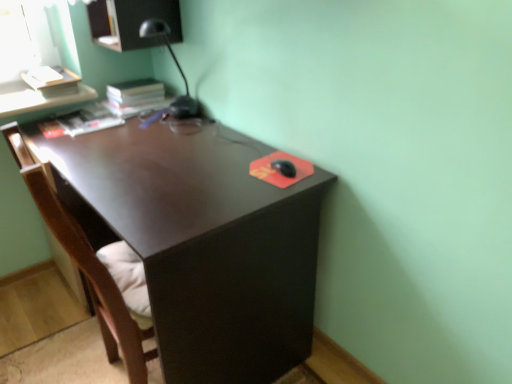
Describe the element at coordinates (201, 241) in the screenshot. Image resolution: width=512 pixels, height=384 pixels. I see `matte black desk at center` at that location.

At what (x,y) coordinates should I click in order to perform the action: click on matte black desk at center. Please return your answer as a coordinate pair (x, y). This screenshot has width=512, height=384. Looking at the image, I should click on (201, 241).

Measure the distance between matte black desk at center and camera.

The distance of matte black desk at center from camera is 99.63 centimeters.

Measure the distance between point [86,282] and camera.

Point [86,282] and camera are 4.85 feet apart from each other.

In order to face brown wood swivel chair at left, should I rotate leftwards or rightwards?

You should rotate left by 19.047 degrees.

Where is `brown wood swivel chair at left`? The image size is (512, 384). brown wood swivel chair at left is located at coordinates (94, 268).

This screenshot has height=384, width=512. What do you see at coordinates (94, 268) in the screenshot?
I see `brown wood swivel chair at left` at bounding box center [94, 268].

Where is `matte black desk at center`? This screenshot has width=512, height=384. matte black desk at center is located at coordinates (201, 241).

In the image, is brown wood swivel chair at left on the left side or the right side of matte black desk at center?

brown wood swivel chair at left is positioned on matte black desk at center's left side.

Considering the positions of objects brown wood swivel chair at left and matte black desk at center in the image provided, who is in front, brown wood swivel chair at left or matte black desk at center?

brown wood swivel chair at left.

Is point (74, 252) more distant than point (101, 200)?

No.

In the scene shown: From the image's perspective, is brown wood swivel chair at left above matte black desk at center?

Actually, brown wood swivel chair at left appears below matte black desk at center in the image.

From a real-world perspective, who is located lower, brown wood swivel chair at left or matte black desk at center?

matte black desk at center is physically lower.

Which object is wider, brown wood swivel chair at left or matte black desk at center?

Wider between the two is matte black desk at center.

Can you confirm if brown wood swivel chair at left is taller than matte black desk at center?

Correct, brown wood swivel chair at left is much taller as matte black desk at center.

In terms of size, does brown wood swivel chair at left appear bigger or smaller than matte black desk at center?

Clearly, brown wood swivel chair at left is smaller in size than matte black desk at center.

Is brown wood swivel chair at left inside the boundaries of matte black desk at center, or outside?

brown wood swivel chair at left fits inside matte black desk at center.

Is brown wood swivel chair at left beside matte black desk at center?

No, brown wood swivel chair at left is not next to matte black desk at center.

Is brown wood swivel chair at left looking in the opposite direction of matte black desk at center?

Correct, brown wood swivel chair at left is looking away from matte black desk at center.

How many degrees apart are the facing directions of brown wood swivel chair at left and matte black desk at center?

The angle between the facing direction of brown wood swivel chair at left and the facing direction of matte black desk at center is 176 degrees.

Locate an element on the screen. swivel chair above the matte black desk at center (from a real-world perspective) is located at coordinates (94, 268).

Which is more to the left, matte black desk at center or brown wood swivel chair at left?

From the viewer's perspective, brown wood swivel chair at left appears more on the left side.

Considering the positions of objects matte black desk at center and brown wood swivel chair at left in the image provided, who is in front, matte black desk at center or brown wood swivel chair at left?

Positioned in front is brown wood swivel chair at left.

Does point (292, 331) appear closer or farther from the camera than point (129, 351)?

Point (292, 331) is farther from the camera than point (129, 351).

From the image's perspective, relative to brown wood swivel chair at left, is matte black desk at center above or below?

Based on their image positions, matte black desk at center is located above brown wood swivel chair at left.

In the scene shown: From a real-world perspective, who is located higher, matte black desk at center or brown wood swivel chair at left?

From a 3D spatial view, brown wood swivel chair at left is above.

Is matte black desk at center wider or thinner than brown wood swivel chair at left?

Clearly, matte black desk at center has more width compared to brown wood swivel chair at left.

Is matte black desk at center taller or shorter than brown wood swivel chair at left?

Considering their sizes, matte black desk at center has less height than brown wood swivel chair at left.

In terms of size, does matte black desk at center appear bigger or smaller than brown wood swivel chair at left?

In the image, matte black desk at center appears to be larger than brown wood swivel chair at left.

Is matte black desk at center positioned beyond the bounds of brown wood swivel chair at left?

Yes, matte black desk at center is outside of brown wood swivel chair at left.

Is matte black desk at center far from brown wood swivel chair at left?

No, matte black desk at center is in close proximity to brown wood swivel chair at left.

Is matte black desk at center facing away from brown wood swivel chair at left?

matte black desk at center is not turned away from brown wood swivel chair at left.

How far apart are matte black desk at center and brown wood swivel chair at left?

A distance of 11.93 inches exists between matte black desk at center and brown wood swivel chair at left.

The width and height of the screenshot is (512, 384). What are the coordinates of `desk on the right of brown wood swivel chair at left` in the screenshot? It's located at (201, 241).

Identify the location of swivel chair located on the left of matte black desk at center. The height and width of the screenshot is (384, 512). (94, 268).

Locate an element on the screen. desk below the brown wood swivel chair at left (from a real-world perspective) is located at coordinates (201, 241).